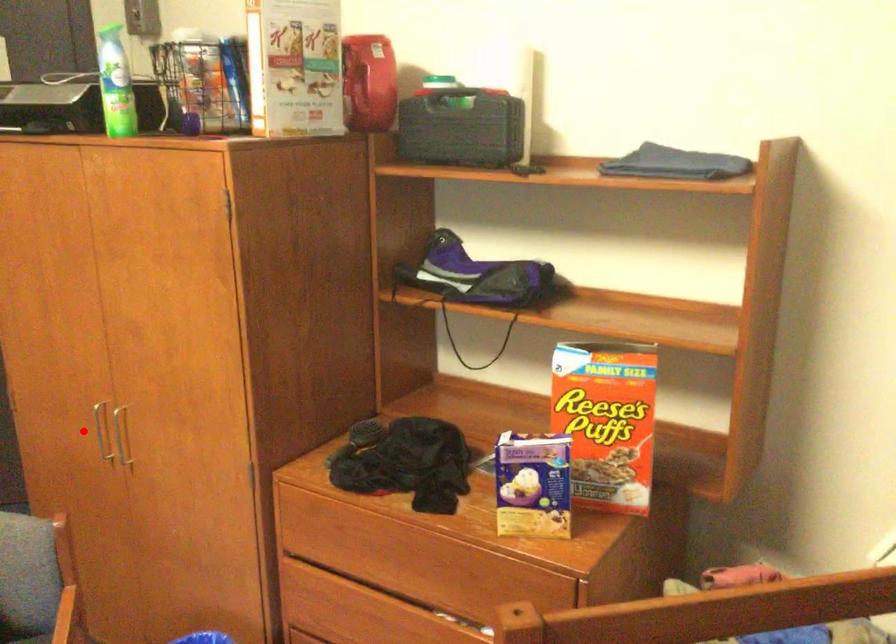
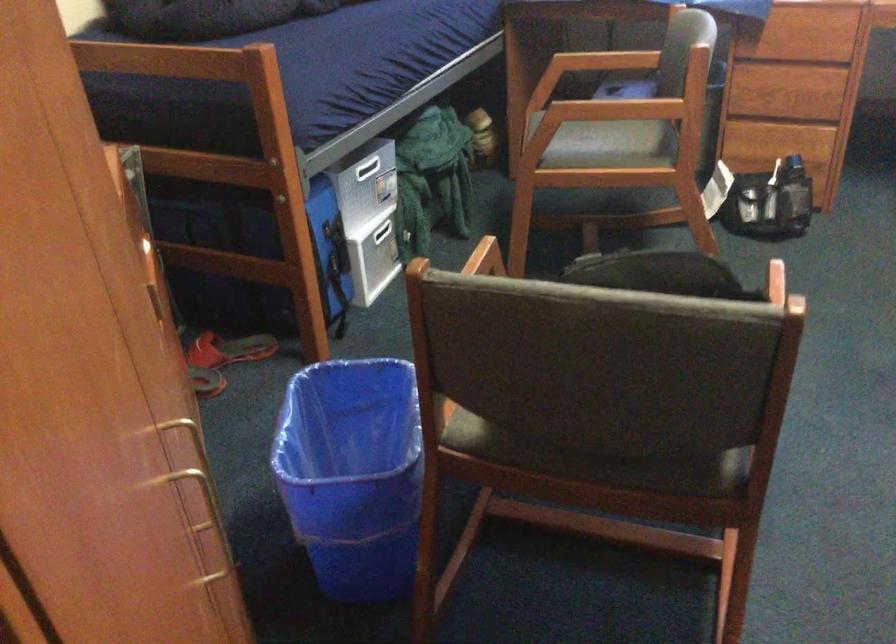
Question: I am providing you with two images of the same scene from different viewpoints. A red point is shown in image1. For the corresponding object point in image2, is it positioned nearer or farther from the camera?

Choices:
 (A) Nearer
 (B) Farther

Answer: (A)